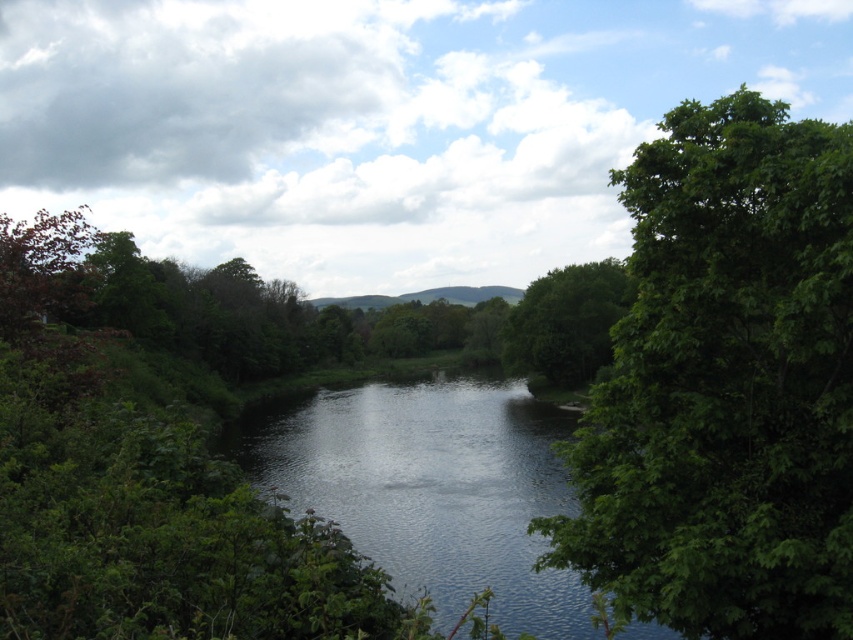
Who is taller, green leafy tree at right or green leafy tree at center?

green leafy tree at center is taller.

Is point (712, 560) positioned after point (567, 276)?

That is False.

The width and height of the screenshot is (853, 640). I want to click on green leafy tree at right, so pos(724,385).